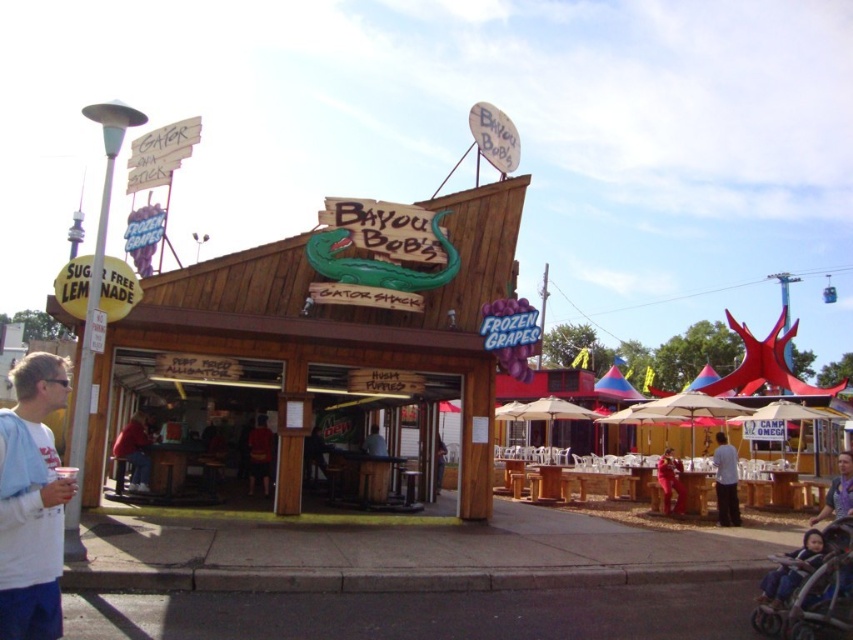
Question: Among these points, which one is nearest to the camera?

Choices:
 (A) (828, 499)
 (B) (741, 413)
 (C) (675, 461)

Answer: (A)

Question: Estimate the real-world distances between objects in this image. Which object is closer to the red fabric shirt at center?

Choices:
 (A) white hoodie at left
 (B) red shirt at lower left
 (C) dark blue fabric stroller at lower right

Answer: (B)

Question: Among these points, which one is nearest to the camera?

Choices:
 (A) (149, 436)
 (B) (821, 536)
 (C) (10, 484)
 (D) (376, 432)

Answer: (C)

Question: Observing the image, what is the correct spatial positioning of white hoodie at left in reference to red fabric shirt at center?

Choices:
 (A) above
 (B) below

Answer: (A)

Question: Is white hoodie at left smaller than red shirt at lower left?

Choices:
 (A) yes
 (B) no

Answer: (A)

Question: Does white hoodie at left have a larger size compared to red fabric shirt at center?

Choices:
 (A) no
 (B) yes

Answer: (A)